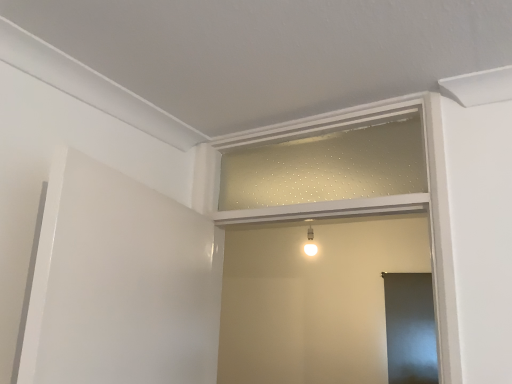
Question: Is point (436, 178) positioned closer to the camera than point (400, 336)?

Choices:
 (A) farther
 (B) closer

Answer: (B)

Question: From a real-world perspective, is white matte window frame at center, the first window frame ordered from the bottom, physically located above or below matte gray screen door at lower right?

Choices:
 (A) below
 (B) above

Answer: (B)

Question: Based on their relative distances, which object is farther from the white matte window frame at center, which is the 2th window frame from top to bottom?

Choices:
 (A) clear glass window frame at center, the 2th window frame from the bottom
 (B) matte gray screen door at lower right

Answer: (B)

Question: Estimate the real-world distances between objects in this image. Which object is closer to the matte gray screen door at lower right?

Choices:
 (A) white matte window frame at center, the first window frame ordered from the bottom
 (B) clear glass window frame at center, marked as the 1th window frame in a top-to-bottom arrangement

Answer: (B)